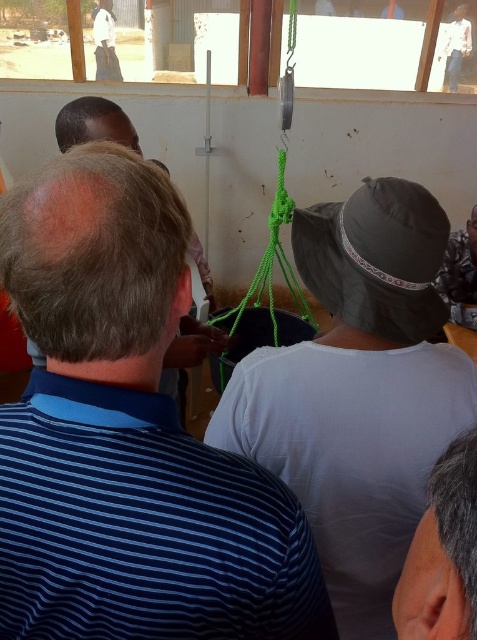
Is white cotton shirt at center above white cotton shirt at upper left?

No.

You are a GUI agent. You are given a task and a screenshot of the screen. Output one action in this format:
    pyautogui.click(x=<x>, y=<y>)
    Task: Click on the white cotton shirt at center
    This screenshot has width=477, height=640.
    Given the screenshot: What is the action you would take?
    pyautogui.click(x=359, y=392)

Is gray hair at lower right taller than white cotton shirt at upper left?

In fact, gray hair at lower right may be shorter than white cotton shirt at upper left.

Can you confirm if gray hair at lower right is positioned below white cotton shirt at upper left?

Correct, gray hair at lower right is located below white cotton shirt at upper left.

The image size is (477, 640). Find the location of `gray hair at lower right`. gray hair at lower right is located at coordinates point(443,554).

At what (x,y) coordinates should I click in order to perform the action: click on gray hair at lower right. Please return your answer as a coordinate pair (x, y). Image resolution: width=477 pixels, height=640 pixels. Looking at the image, I should click on (443, 554).

Can you confirm if white cotton shirt at center is shorter than white cotton shirt at upper right?

Incorrect, white cotton shirt at center's height does not fall short of white cotton shirt at upper right's.

Which is behind, point (383, 483) or point (444, 44)?

The point (444, 44) is behind.

This screenshot has width=477, height=640. Identify the location of white cotton shirt at center. (359, 392).